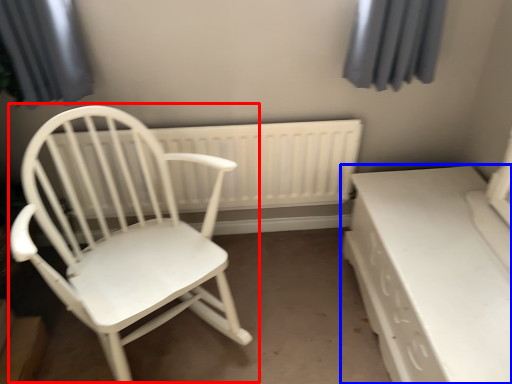
Question: Which object appears farthest to the camera in this image, chair (highlighted by a red box) or table (highlighted by a blue box)?

Choices:
 (A) chair
 (B) table

Answer: (B)